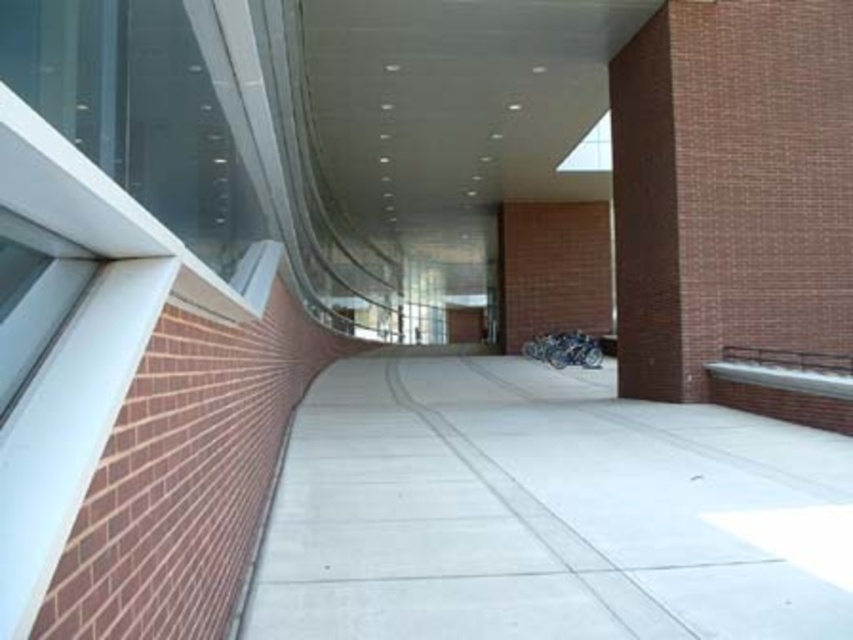
Between point (700, 616) and point (672, 184), which one is positioned in front?

Positioned in front is point (700, 616).

Which of these two, concrete at center or brown brick pillar at right, stands shorter?

concrete at center

The image size is (853, 640). Identify the location of concrete at center. (546, 513).

Is brown brick pillar at right positioned behind transparent glass window at upper center?

No, it is in front of transparent glass window at upper center.

In the scene shown: Who is higher up, brown brick pillar at right or transparent glass window at upper center?

transparent glass window at upper center is above.

Which is behind, point (677, 268) or point (606, 125)?

Point (606, 125)

Locate an element on the screen. This screenshot has height=640, width=853. brown brick pillar at right is located at coordinates (645, 216).

Which is more to the right, concrete at center or transparent glass window at upper center?

Positioned to the right is transparent glass window at upper center.

Does concrete at center have a lesser height compared to transparent glass window at upper center?

Yes.

Where is `concrete at center`? This screenshot has height=640, width=853. concrete at center is located at coordinates (546, 513).

This screenshot has height=640, width=853. In order to click on concrete at center in this screenshot , I will do `click(546, 513)`.